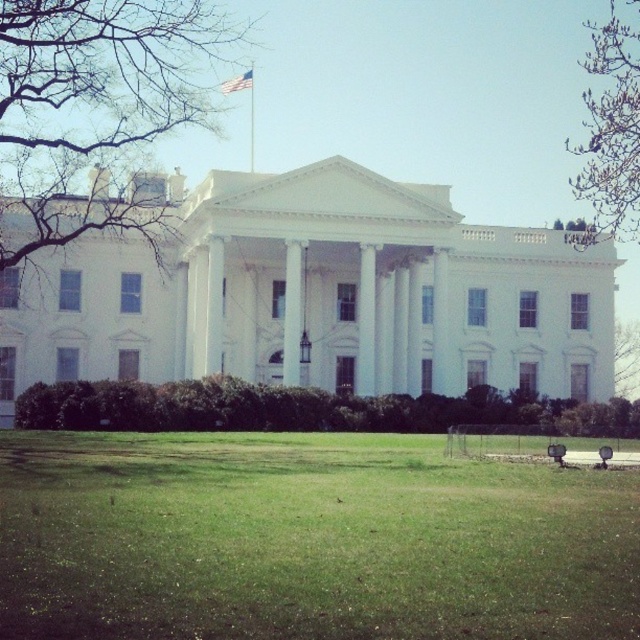
You are standing at the entrance of the White House and want to walk towards the green grass at center. Which direction should you head?

The green grass at center is located at point coordinates, so you should head towards the center of the lawn area in front of the White House.

You are planning to place a new bench in the White House lawn area. The bench will be placed between the green grass at center and the metallic flag pole at upper center. Considering their sizes, which object will the bench be closer to?

The bench will be closer to the metallic flag pole at upper center because the green grass at center has a larger size, meaning the flag pole is smaller and likely closer in proximity.

You are standing in front of the White House and notice the metallic flag pole at upper center and the white fabric flag at upper center. Which object is positioned higher in the scene?

The white fabric flag at upper center is positioned higher than the metallic flag pole at upper center.